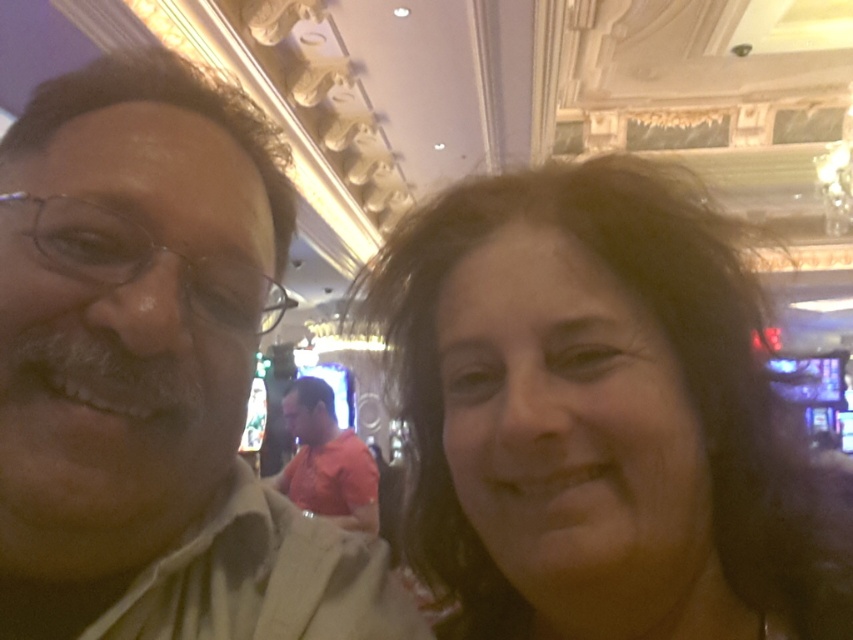
Who is positioned more to the right, matte beige shirt at left or orange cotton shirt at center?

Positioned to the right is matte beige shirt at left.

Can you confirm if matte beige shirt at left is wider than orange cotton shirt at center?

Incorrect, matte beige shirt at left's width does not surpass orange cotton shirt at center's.

Who is more distant from viewer, [74,566] or [335,508]?

The point [335,508] is more distant.

Find the location of `matte beige shirt at left`. matte beige shirt at left is located at coordinates (154, 376).

Which is more to the right, dark brown hair at center or orange cotton shirt at center?

dark brown hair at center

Between point (660, 448) and point (310, 474), which one is positioned in front?

Point (660, 448) is in front.

Where is `dark brown hair at center`? dark brown hair at center is located at coordinates (601, 417).

In the scene shown: Which of these two, dark brown hair at center or matte beige shirt at left, stands shorter?

dark brown hair at center is shorter.

Who is more distant from viewer, (456, 264) or (0, 556)?

The point (456, 264) is more distant.

This screenshot has width=853, height=640. Identify the location of dark brown hair at center. (601, 417).